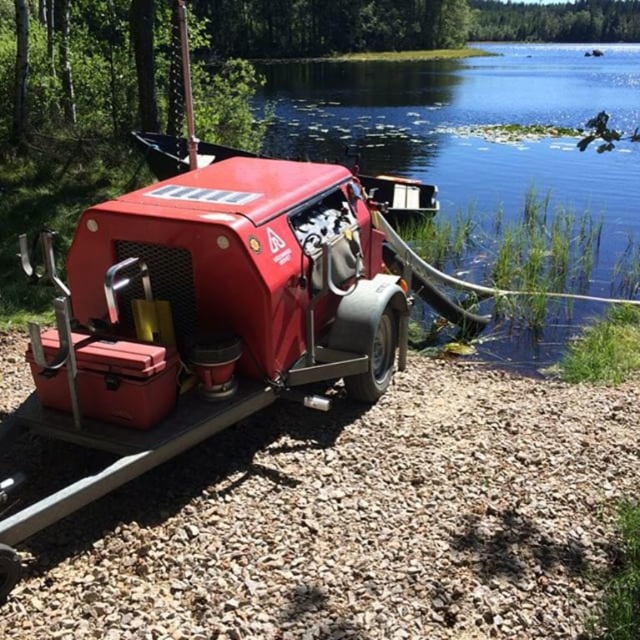
Question: Can you confirm if smooth gravel shore at lower right is positioned to the left of clear water at lower right?

Choices:
 (A) no
 (B) yes

Answer: (B)

Question: Does smooth gravel shore at lower right have a larger size compared to clear water at lower right?

Choices:
 (A) no
 (B) yes

Answer: (A)

Question: Can you confirm if smooth gravel shore at lower right is thinner than clear water at lower right?

Choices:
 (A) no
 (B) yes

Answer: (B)

Question: Which of the following is the closest to the observer?

Choices:
 (A) (632, 68)
 (B) (182, 477)

Answer: (B)

Question: Which of the following is the farthest from the observer?

Choices:
 (A) (12, 340)
 (B) (570, 52)

Answer: (B)